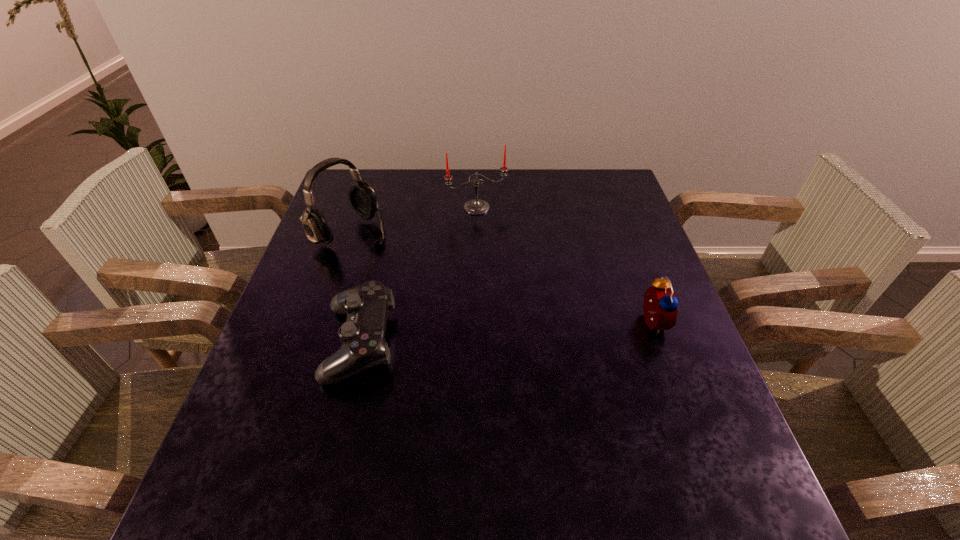
Identify the location of the shortest object. The height and width of the screenshot is (540, 960). (363, 345).

At what (x,y) coordinates should I click in order to perform the action: click on alarm clock. Please return your answer as a coordinate pair (x, y). Looking at the image, I should click on (660, 306).

This screenshot has height=540, width=960. Identify the location of the third tallest object. (660, 306).

Find the location of a particular element. The width and height of the screenshot is (960, 540). headset is located at coordinates (362, 197).

Where is `the second object from right to left`? The height and width of the screenshot is (540, 960). the second object from right to left is located at coordinates (476, 206).

I want to click on vacant point located on the right of the control, so click(575, 342).

Identify the location of free space located with the microphone on the side of the headset. The width and height of the screenshot is (960, 540). (472, 310).

This screenshot has width=960, height=540. I want to click on free space located with the microphone on the side of the headset, so click(x=417, y=274).

Find the location of a particular element. The width and height of the screenshot is (960, 540). free space located with the microphone on the side of the headset is located at coordinates (396, 260).

Find the location of a particular element. The image size is (960, 540). free space located on the front-facing side of the third object from left to right is located at coordinates 494,231.